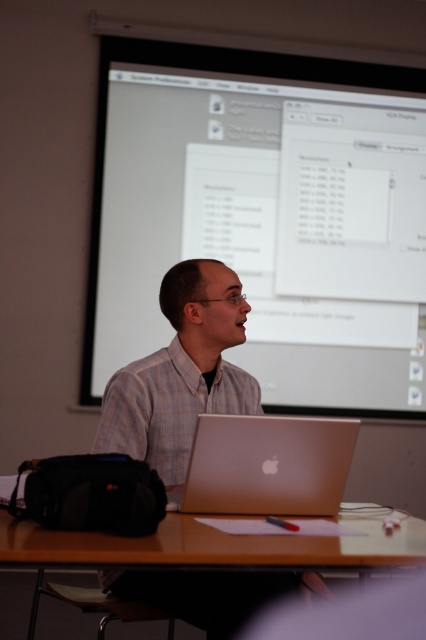
Is point (339, 186) more distant than point (221, 332)?

Yes.

The image size is (426, 640). What are the coordinates of `white glossy projection screen at upper center` in the screenshot? It's located at (265, 216).

Which of these two, white glossy projection screen at upper center or brown wooden table at center, stands shorter?

With less height is brown wooden table at center.

Who is more forward, (158, 332) or (29, 531)?

Point (29, 531) is in front.

Image resolution: width=426 pixels, height=640 pixels. In order to click on white glossy projection screen at upper center in this screenshot , I will do `click(265, 216)`.

Which is more to the left, brown wooden table at center or satin gold laptop at center?

brown wooden table at center

Who is more forward, (x=273, y=556) or (x=261, y=490)?

Point (x=273, y=556) is more forward.

Locate an element on the screen. This screenshot has height=640, width=426. brown wooden table at center is located at coordinates (218, 545).